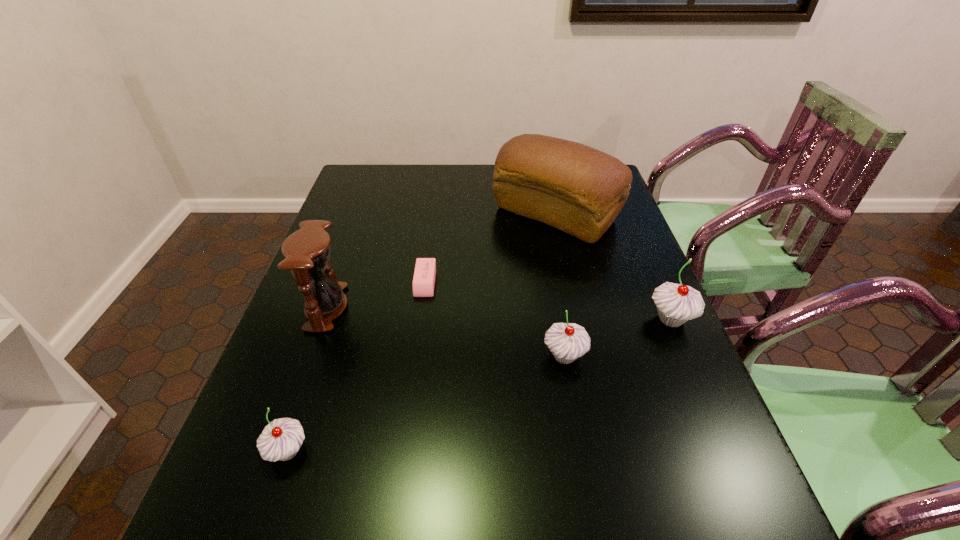
Locate an element on the screen. the nearest cupcake is located at coordinates (281, 439).

Image resolution: width=960 pixels, height=540 pixels. I want to click on the leftmost cupcake, so click(281, 439).

Image resolution: width=960 pixels, height=540 pixels. I want to click on the fifth farthest object, so click(567, 341).

At what (x,y) coordinates should I click in order to perform the action: click on the second tallest cupcake. Please return your answer as a coordinate pair (x, y). This screenshot has width=960, height=540. Looking at the image, I should click on (567, 341).

At what (x,y) coordinates should I click in order to perform the action: click on the rightmost cupcake. Please return your answer as a coordinate pair (x, y). Image resolution: width=960 pixels, height=540 pixels. Looking at the image, I should click on (x=676, y=304).

Image resolution: width=960 pixels, height=540 pixels. Find the location of `the shortest object`. the shortest object is located at coordinates (423, 283).

Find the location of a particular element. Image resolution: width=960 pixels, height=540 pixels. the third object from left to right is located at coordinates point(423,283).

I want to click on bread, so click(x=575, y=188).

Locate an element on the screen. the fifth shortest object is located at coordinates (307, 251).

Where is `free space located on the back of the shortest cupcake`? The width and height of the screenshot is (960, 540). free space located on the back of the shortest cupcake is located at coordinates (329, 329).